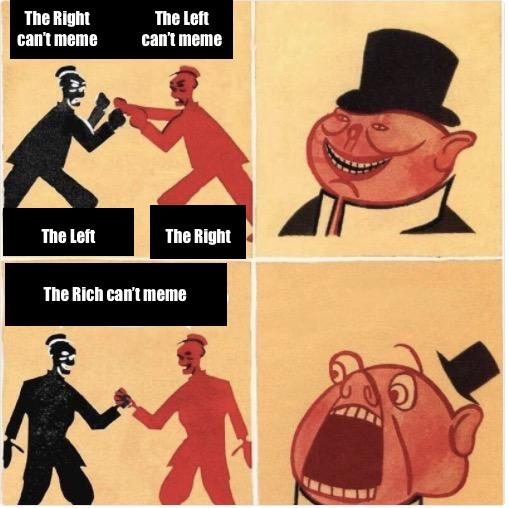
The image size is (509, 508). I want to click on panel, so click(126, 179), click(326, 63), click(132, 434), click(332, 318).